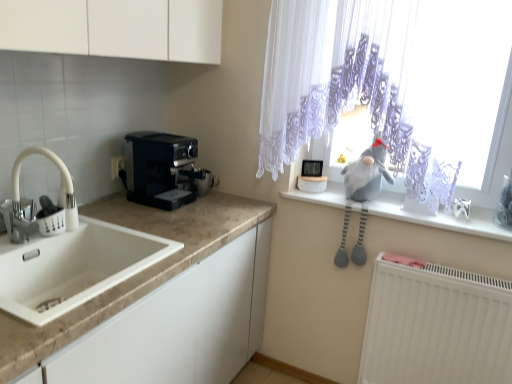
Identify the location of blank space situated above gray fabric at upper right (from a real-world perspective). The width and height of the screenshot is (512, 384). (398, 205).